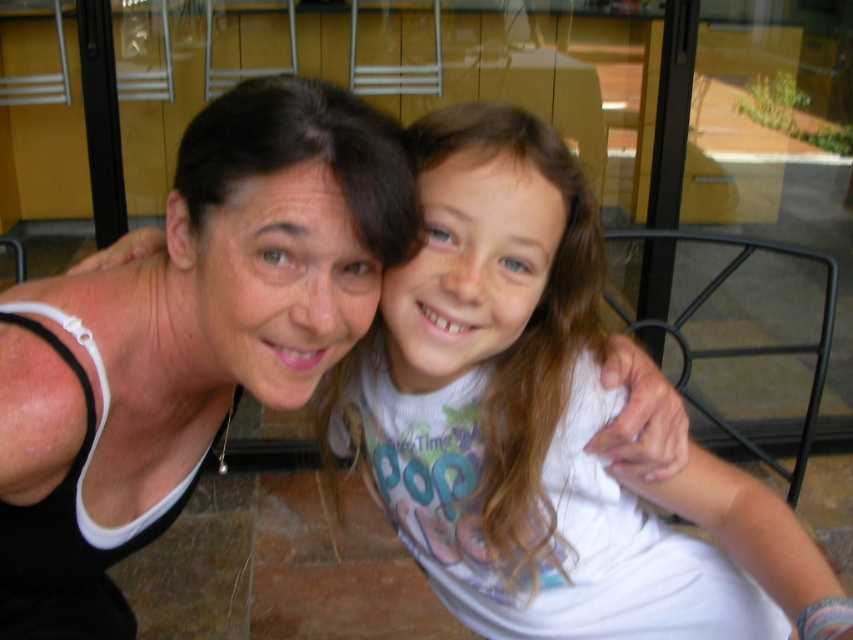
Is white cotton shirt at center closer to the viewer compared to matte black tank top at upper left?

No, white cotton shirt at center is behind matte black tank top at upper left.

Between white cotton shirt at center and matte black tank top at upper left, which one appears on the left side from the viewer's perspective?

From the viewer's perspective, matte black tank top at upper left appears more on the left side.

Between point (799, 576) and point (157, 362), which one is positioned in front?

Point (799, 576) is in front.

The width and height of the screenshot is (853, 640). Find the location of `white cotton shirt at center`. white cotton shirt at center is located at coordinates (537, 416).